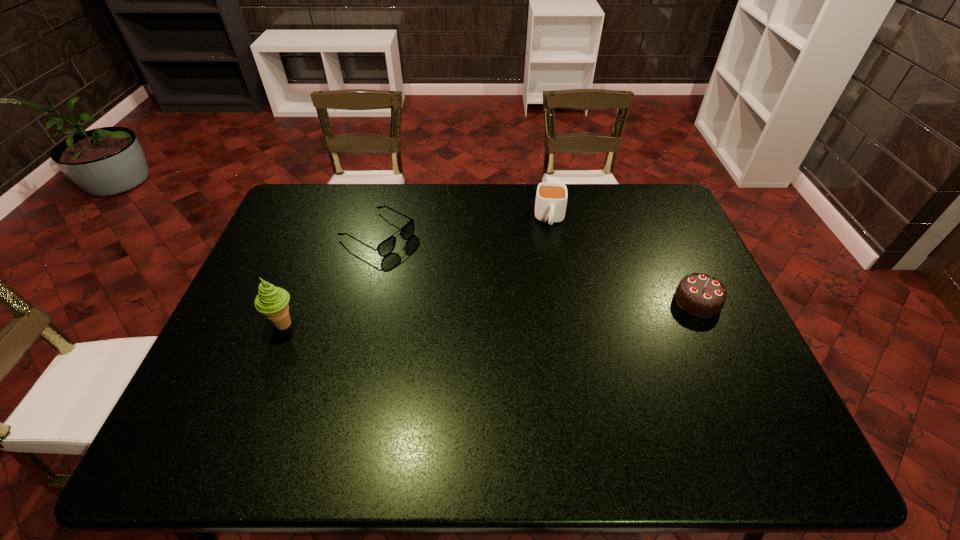
Identify the location of the tallest object. This screenshot has height=540, width=960. (271, 301).

Locate an element on the screen. Image resolution: width=960 pixels, height=540 pixels. icecream is located at coordinates (271, 301).

Locate an element on the screen. the rightmost object is located at coordinates (701, 295).

This screenshot has width=960, height=540. Identify the location of cup. (551, 198).

Where is `the shortest object`? Image resolution: width=960 pixels, height=540 pixels. the shortest object is located at coordinates (386, 247).

Find the location of `the third object from right to left`. the third object from right to left is located at coordinates (386, 247).

At what (x,y) coordinates should I click in order to perform the action: click on vacant area situated on the front of the tallest object. Please return your answer as a coordinate pair (x, y). Looking at the image, I should click on (266, 370).

This screenshot has height=540, width=960. What are the coordinates of `vacant space located on the back of the chocolate cake` in the screenshot? It's located at (673, 248).

Locate an element on the screen. free space located 0.340m on the side with the handle of the third object from left to right is located at coordinates pos(554,315).

In order to click on free space located 0.080m on the side with the handle of the third object from left to right in this screenshot , I will do `click(552, 251)`.